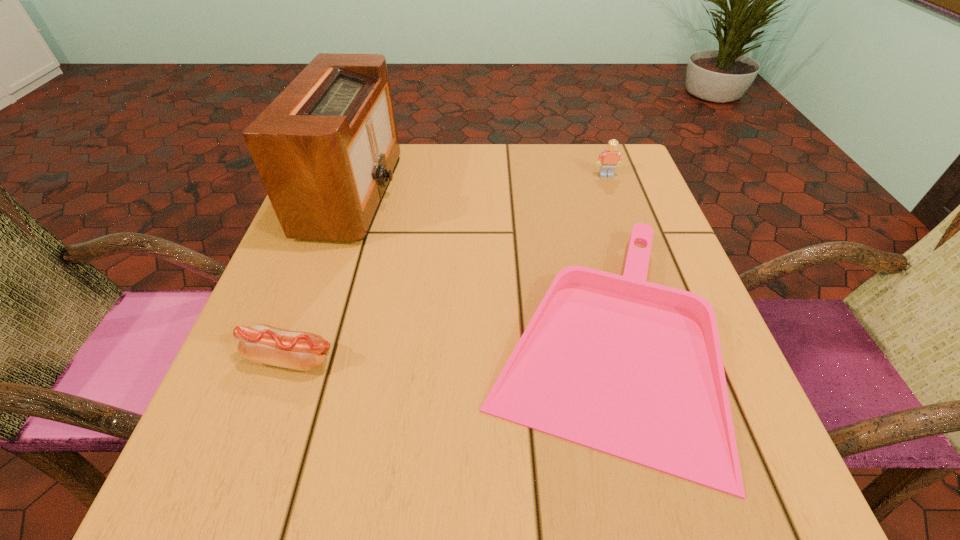
I want to click on radio receiver, so click(326, 148).

Where is `the third shortest object`? The width and height of the screenshot is (960, 540). the third shortest object is located at coordinates (608, 159).

I want to click on sausage, so click(x=260, y=343).

Locate an element on the screen. dustpan is located at coordinates (634, 369).

This screenshot has height=540, width=960. Identify the location of vacant area situated on the front of the radio receiver. (278, 411).

Where is `vacant space located 0.210m on the front-facing side of the Lego`? vacant space located 0.210m on the front-facing side of the Lego is located at coordinates (628, 236).

Find the location of `vacant area situated 0.140m on the back of the sausage`. vacant area situated 0.140m on the back of the sausage is located at coordinates (320, 278).

The width and height of the screenshot is (960, 540). Find the location of `vacant space located on the handle side of the dustpan`. vacant space located on the handle side of the dustpan is located at coordinates (253, 339).

I want to click on free space located 0.240m on the handle side of the dustpan, so click(333, 339).

Image resolution: width=960 pixels, height=540 pixels. In order to click on vacant area situated on the handle side of the dustpan in this screenshot , I will do `click(253, 339)`.